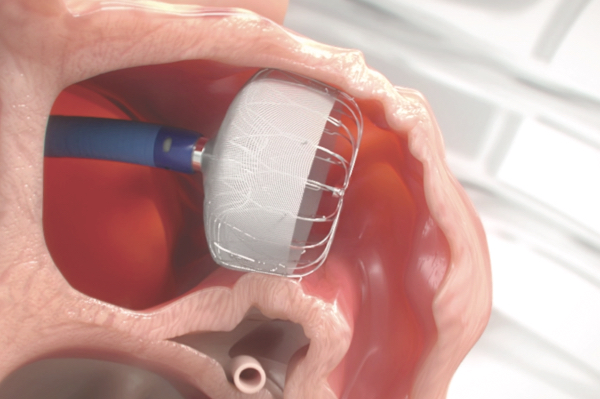
Identify the location of shelf. (544, 150), (538, 288).